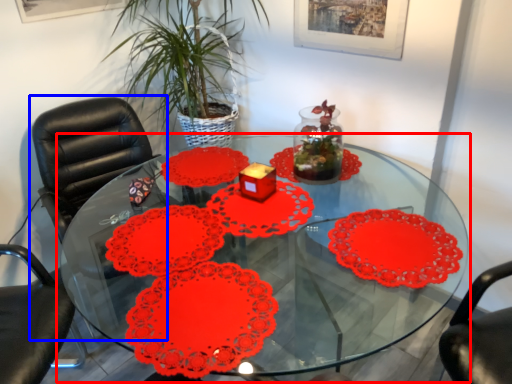
Question: Which object is closer to the camera taking this photo, table (highlighted by a red box) or chair (highlighted by a blue box)?

Choices:
 (A) table
 (B) chair

Answer: (A)